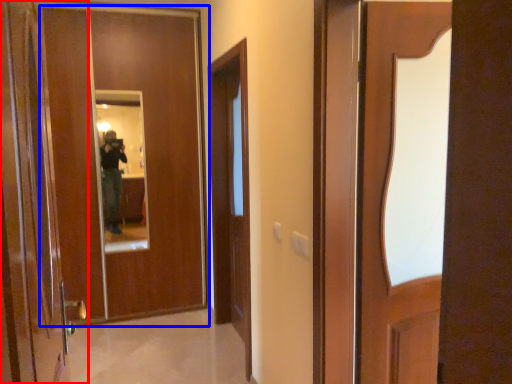
Question: Which of the following is the closest to the observer, door (highlighted by a red box) or door (highlighted by a blue box)?

Choices:
 (A) door
 (B) door

Answer: (A)